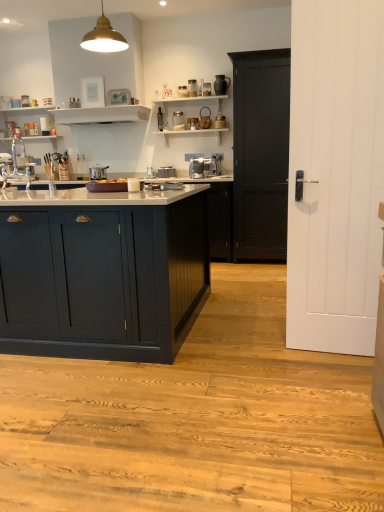
Question: From a real-world perspective, is white glossy shelf at upper center, which ranks as the second shelf in left-to-right order, physically located above or below satin silver pot at center, which appears as the first appliance when viewed from the left?

Choices:
 (A) above
 (B) below

Answer: (A)

Question: Is point (135, 114) closer or farther from the camera than point (97, 173)?

Choices:
 (A) farther
 (B) closer

Answer: (B)

Question: Based on their relative distances, which object is nearer to the satin silver pot at center, which ranks as the 2th appliance in right-to-left order?

Choices:
 (A) satin silver coffee machine at center
 (B) white glossy shelf at upper center, which ranks as the second shelf in left-to-right order
 (C) white ceramic mugs at upper left, the first shelf in the left-to-right sequence
 (D) satin silver toaster at center, placed as the 2th appliance when sorted from left to right
 (E) matte dark blue cabinet at center-left, acting as the first cabinetry starting from the front

Answer: (B)

Question: Which of these objects is positioned closest to the metallic gold pendant light at upper center?

Choices:
 (A) matte black cabinet at center, marked as the first cabinetry in a right-to-left arrangement
 (B) white ceramic mugs at upper left, the first shelf in the left-to-right sequence
 (C) satin silver coffee machine at center
 (D) matte dark blue cabinet at center-left, which appears as the 1th cabinetry when viewed from the left
 (E) white glossy shelf at upper center, arranged as the 1th shelf when viewed from the right

Answer: (C)